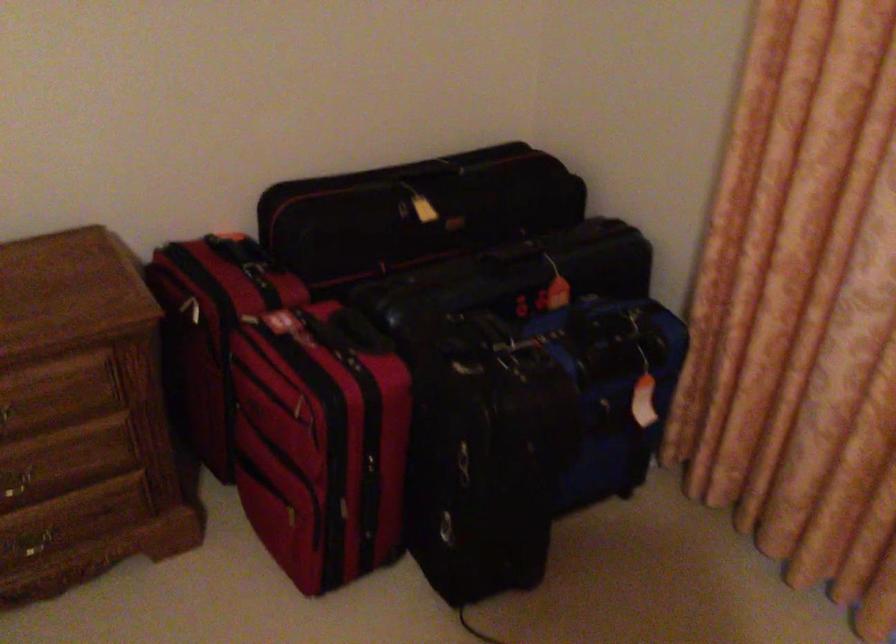
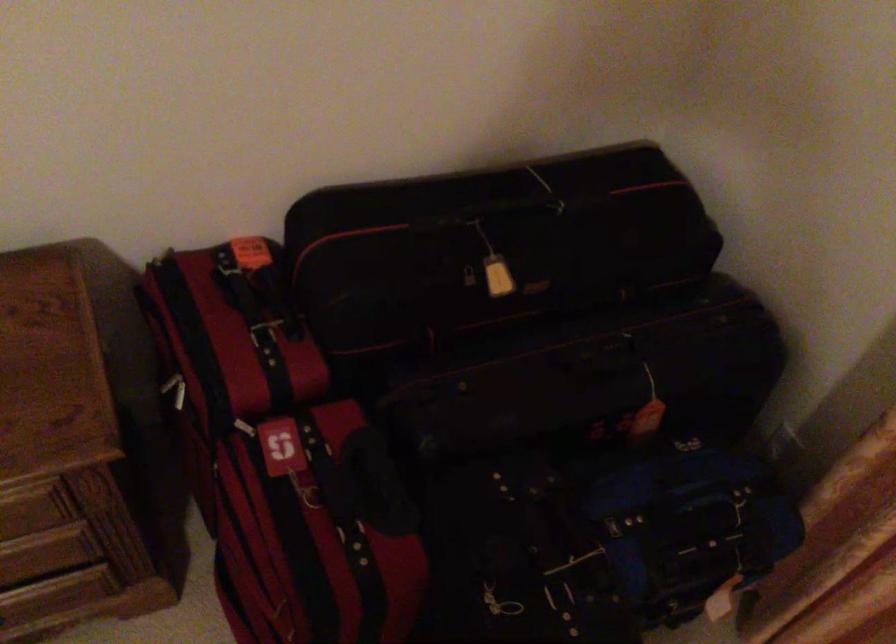
Find the pixel in the second image that matches point (254, 270) in the first image.

(264, 334)